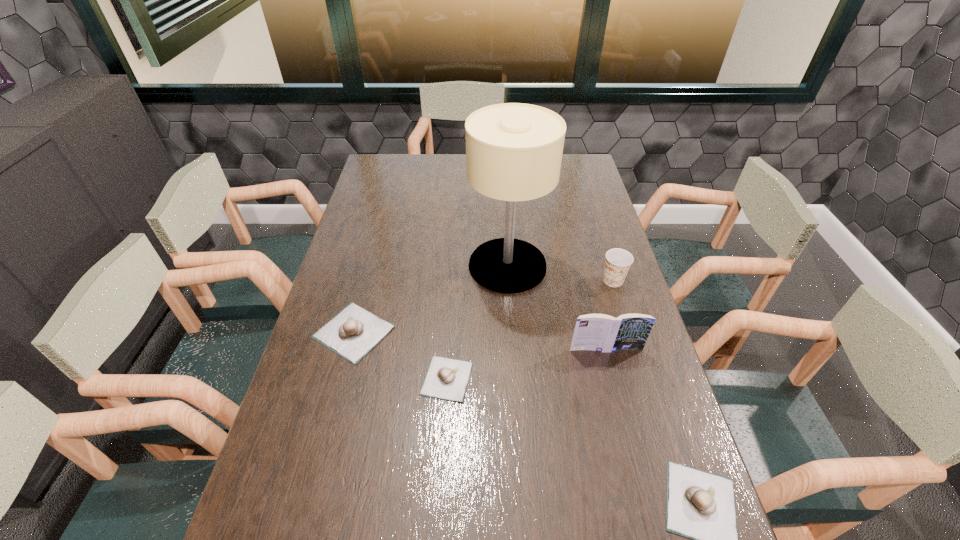
Locate an element on the screen. location for an additional garlic to make spacing equal is located at coordinates (561, 434).